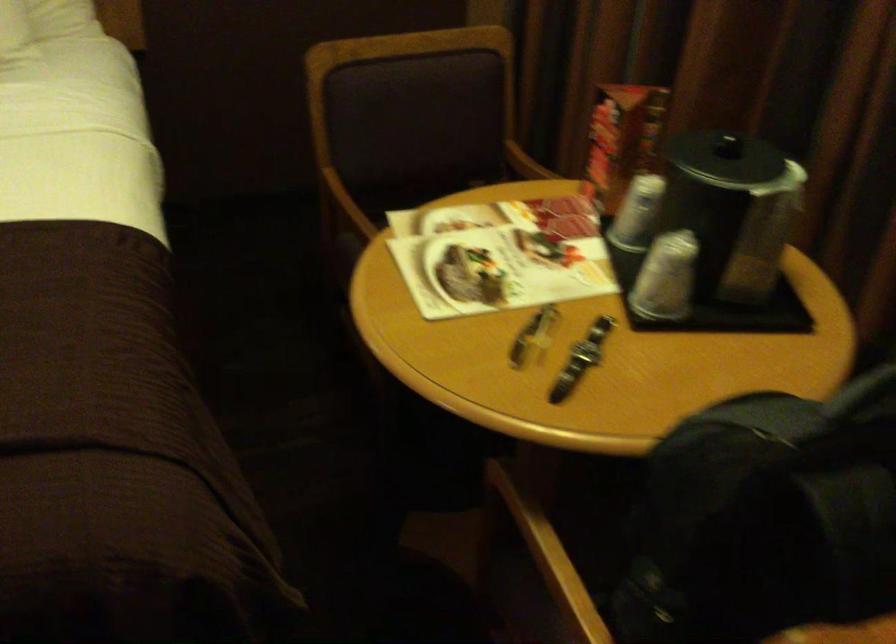
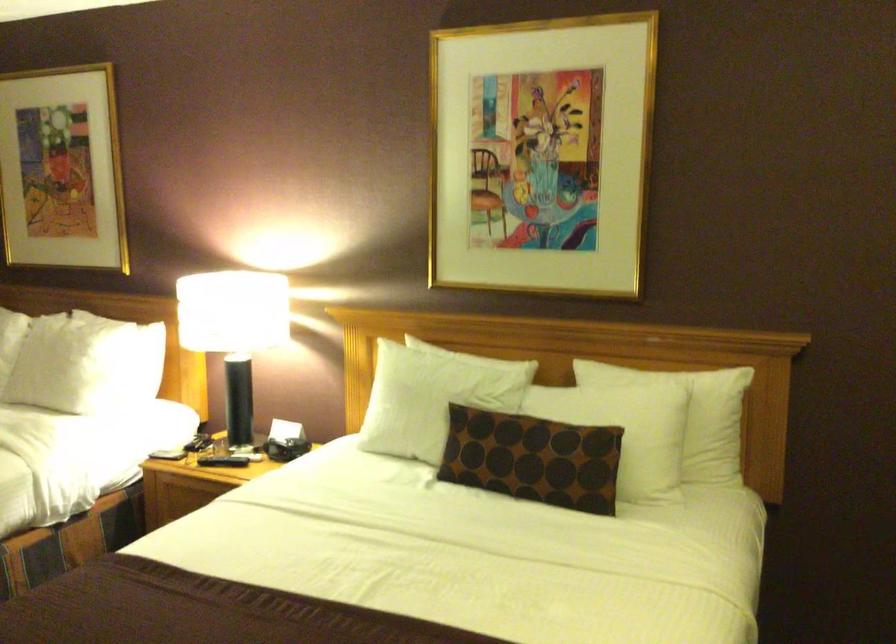
The images are taken continuously from a first-person perspective. In which direction is your viewpoint rotating?

The camera rotated toward left-up.